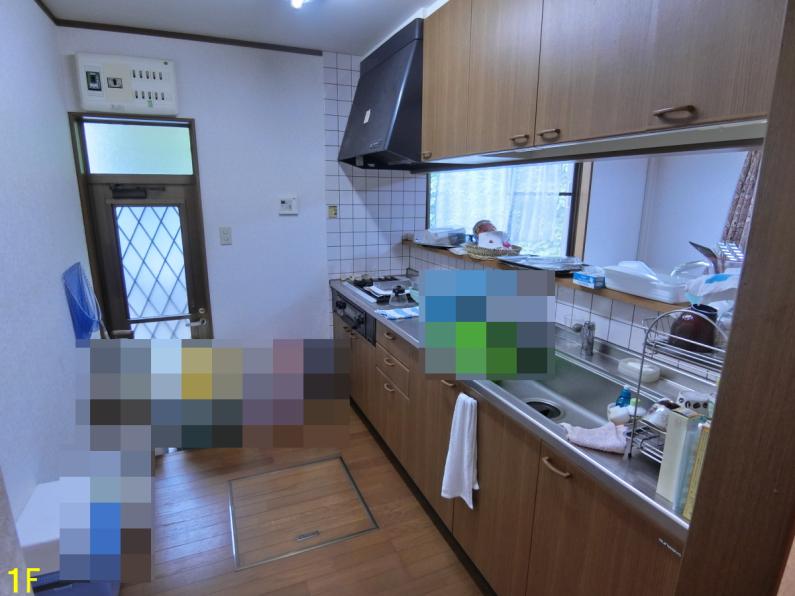
The image size is (795, 596). In order to click on curtains in this screenshot , I will do `click(530, 201)`.